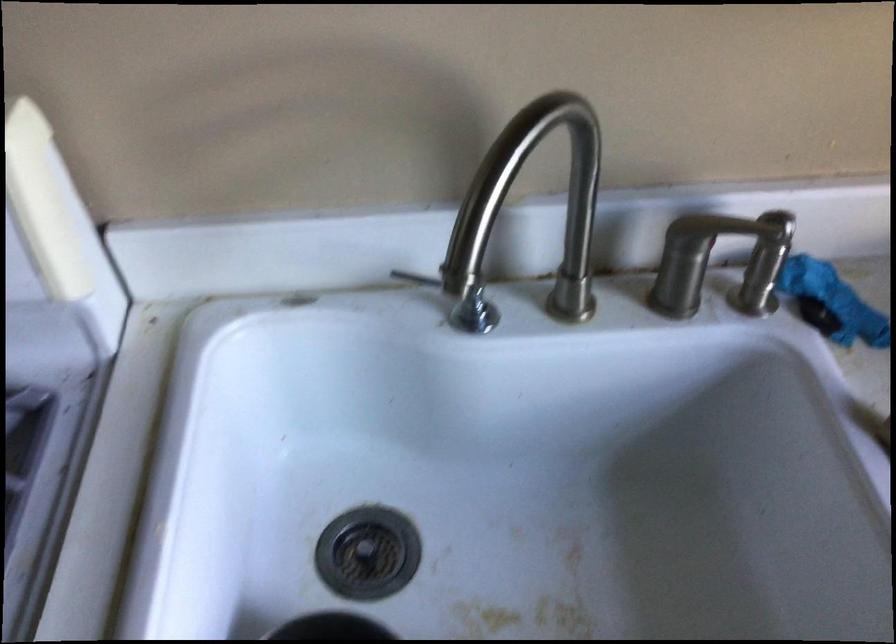
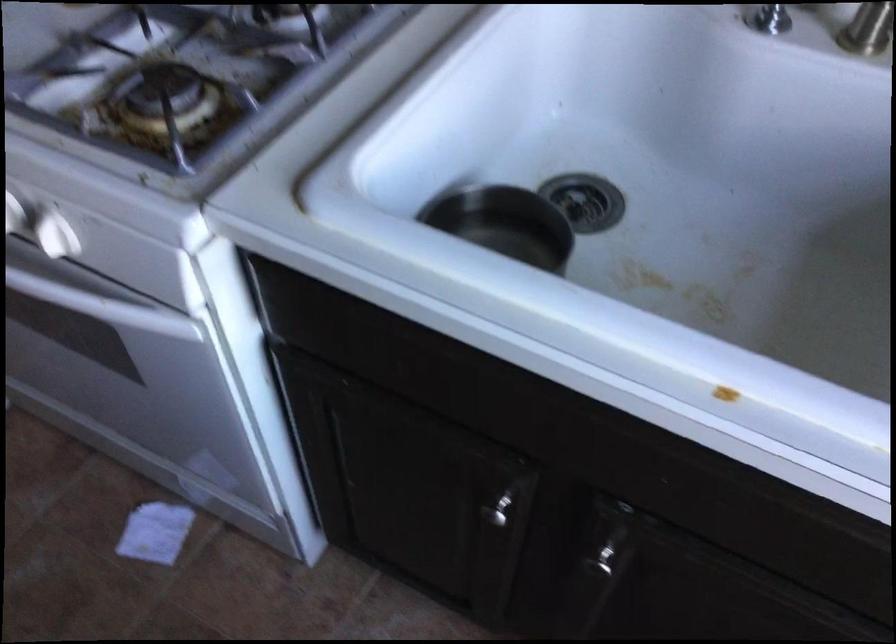
Locate, in the second image, the point that corresponds to point 494,305 in the first image.

(787, 15)